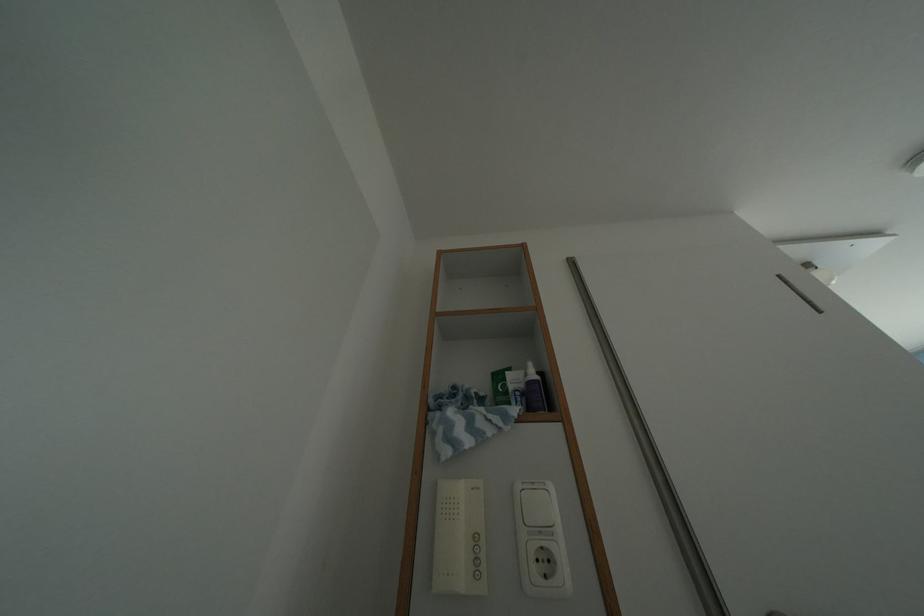
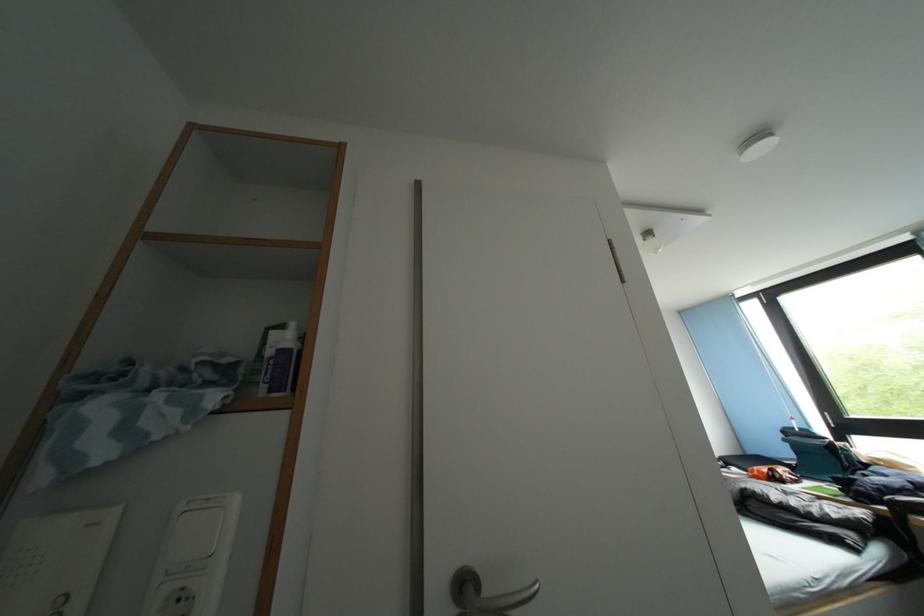
The point at (545, 565) is marked in the first image. Where is the corresponding point in the second image?

(188, 604)